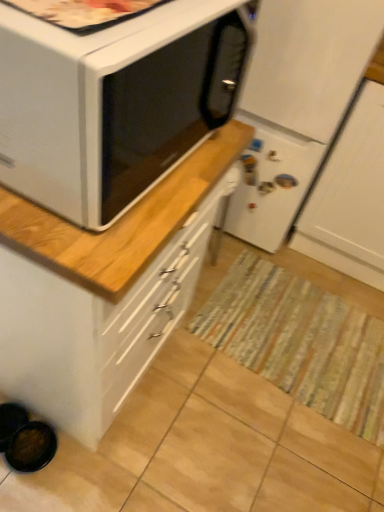
Question: From a real-world perspective, is striped fabric mat at center under white matte refrigerator at center?

Choices:
 (A) no
 (B) yes

Answer: (B)

Question: Does striped fabric mat at center have a larger size compared to white matte refrigerator at center?

Choices:
 (A) yes
 (B) no

Answer: (B)

Question: Is striped fabric mat at center taller than white matte refrigerator at center?

Choices:
 (A) no
 (B) yes

Answer: (A)

Question: Is striped fabric mat at center shorter than white matte refrigerator at center?

Choices:
 (A) no
 (B) yes

Answer: (B)

Question: Is striped fabric mat at center at the left side of white matte refrigerator at center?

Choices:
 (A) yes
 (B) no

Answer: (B)

Question: Would you say striped fabric mat at center is a long distance from white matte refrigerator at center?

Choices:
 (A) yes
 (B) no

Answer: (B)

Question: Can you confirm if white matte microwave oven at upper left is positioned to the left of white matte refrigerator at center?

Choices:
 (A) no
 (B) yes

Answer: (B)

Question: From the image's perspective, would you say white matte microwave oven at upper left is positioned over white matte refrigerator at center?

Choices:
 (A) yes
 (B) no

Answer: (B)

Question: From the image's perspective, is white matte microwave oven at upper left located beneath white matte refrigerator at center?

Choices:
 (A) yes
 (B) no

Answer: (A)

Question: Does white matte microwave oven at upper left have a smaller size compared to white matte refrigerator at center?

Choices:
 (A) no
 (B) yes

Answer: (B)

Question: From a real-world perspective, is white matte microwave oven at upper left on white matte refrigerator at center?

Choices:
 (A) no
 (B) yes

Answer: (B)

Question: Is white matte microwave oven at upper left shorter than white matte refrigerator at center?

Choices:
 (A) yes
 (B) no

Answer: (A)

Question: Can you confirm if white matte refrigerator at center is taller than striped fabric mat at center?

Choices:
 (A) yes
 (B) no

Answer: (A)